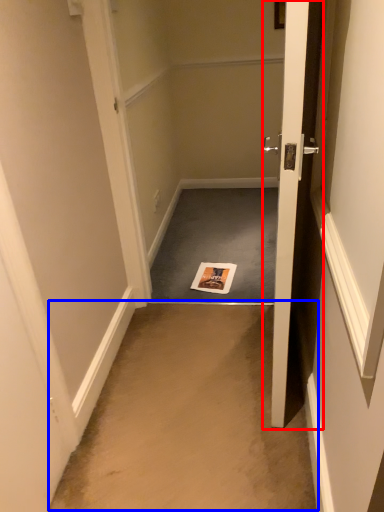
Question: Which point is closer to the camera, door (highlighted by a red box) or corridor (highlighted by a blue box)?

Choices:
 (A) door
 (B) corridor

Answer: (A)